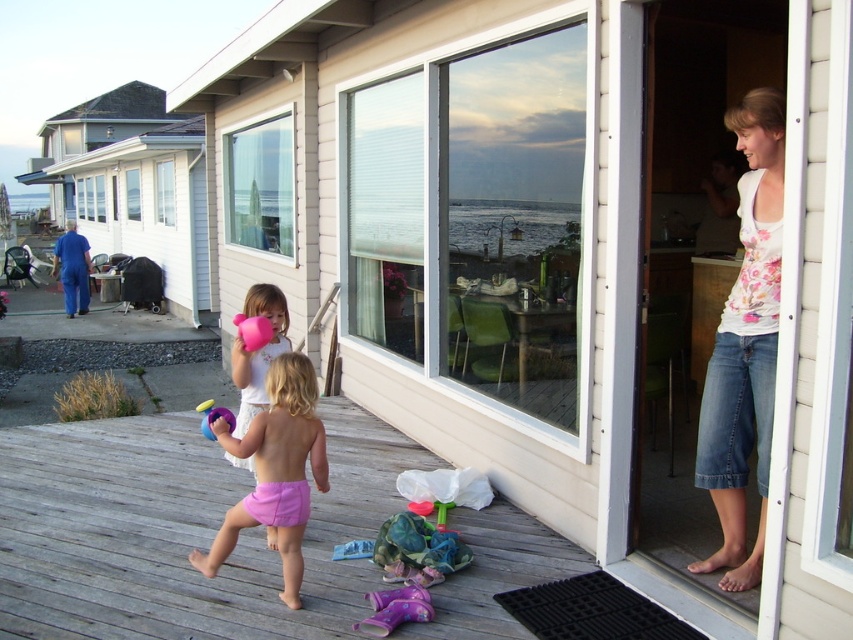
Question: Where is white matte screen door at upper right located in relation to pink matte watering can at center in the image?

Choices:
 (A) left
 (B) right

Answer: (B)

Question: Is pink fabric shorts at center thinner than pink fabric balloon at center?

Choices:
 (A) yes
 (B) no

Answer: (B)

Question: Is transparent glass door at center thinner than pink matte watering can at center?

Choices:
 (A) yes
 (B) no

Answer: (B)

Question: Which point is farther to the camera?

Choices:
 (A) (397, 112)
 (B) (751, 435)
 (C) (229, 428)

Answer: (A)

Question: Which of the following is the farthest from the observer?

Choices:
 (A) pink fabric shorts at lower center
 (B) pink fabric shorts at center

Answer: (B)

Question: Considering the real-world distances, which object is closest to the rubber pink ball at center?

Choices:
 (A) pink fabric balloon at center
 (B) pink fabric shorts at center
 (C) pink fabric shorts at lower center
 (D) floral cotton shirt at upper right

Answer: (B)